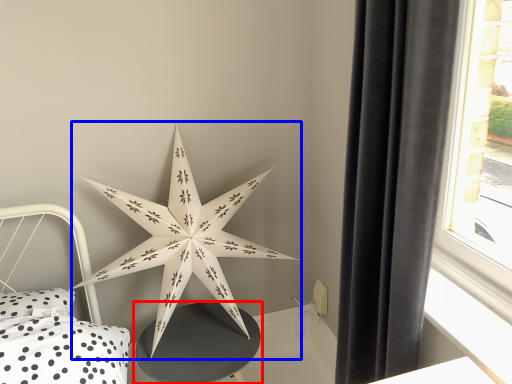
Question: Among these objects, which one is farthest to the camera, table (highlighted by a red box) or star (highlighted by a blue box)?

Choices:
 (A) table
 (B) star

Answer: (A)